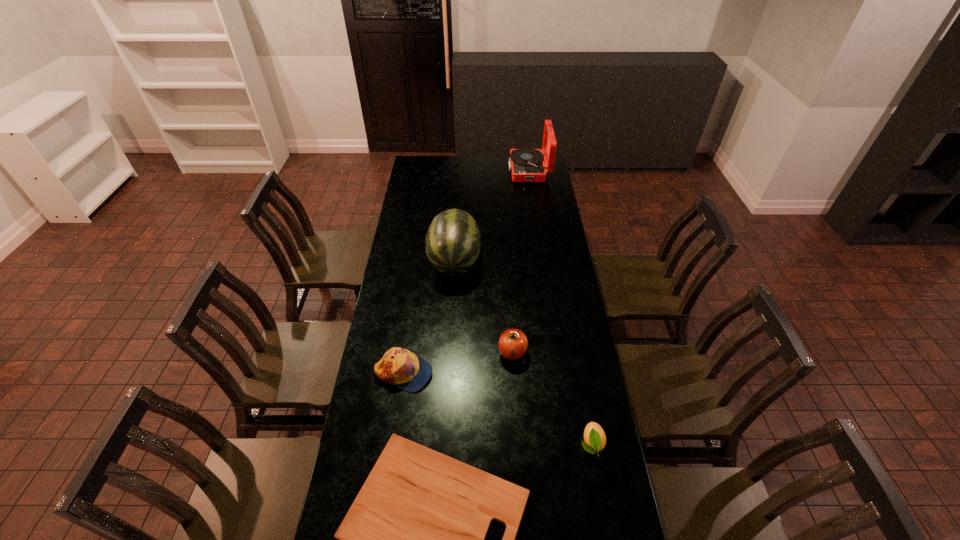
Find the location of a particular element. This screenshot has height=540, width=960. free space located on the bill of the third shortest object is located at coordinates (508, 373).

Where is `free space located with leaves positioned above the lemon`? This screenshot has height=540, width=960. free space located with leaves positioned above the lemon is located at coordinates (601, 498).

At what (x,y) coordinates should I click in order to perform the action: click on object that is at the far edge. Please return your answer as a coordinate pair (x, y). Image resolution: width=960 pixels, height=540 pixels. Looking at the image, I should click on (527, 165).

Image resolution: width=960 pixels, height=540 pixels. Find the location of `object located at the left edge`. object located at the left edge is located at coordinates (401, 367).

In order to click on phonograph_record at the right edge in this screenshot , I will do `click(527, 165)`.

This screenshot has width=960, height=540. Find the location of `lemon that is positioned at the right edge`. lemon that is positioned at the right edge is located at coordinates (595, 439).

Where is `object positioned at the far right corner`? object positioned at the far right corner is located at coordinates (527, 165).

This screenshot has width=960, height=540. In order to click on free space at the far edge of the desktop in this screenshot , I will do `click(506, 159)`.

Locate an element on the screen. vacant space at the left edge of the desktop is located at coordinates tap(408, 331).

You are a GUI agent. You are given a task and a screenshot of the screen. Output one action in this format:
    pyautogui.click(x=<x>, y=<y>)
    Task: Click on the vacant space at the right edge of the desktop
    
    Given the screenshot: What is the action you would take?
    pyautogui.click(x=585, y=368)